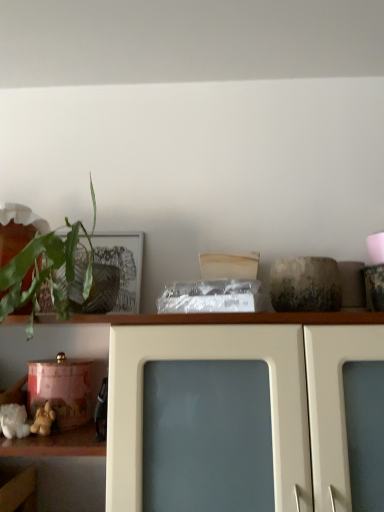
Question: From the image's perspective, is green leafy plant at left below white glossy cabinet at upper center?

Choices:
 (A) no
 (B) yes

Answer: (A)

Question: Does green leafy plant at left have a greater height compared to white glossy cabinet at upper center?

Choices:
 (A) no
 (B) yes

Answer: (A)

Question: From the image's perspective, is green leafy plant at left on top of white glossy cabinet at upper center?

Choices:
 (A) no
 (B) yes

Answer: (B)

Question: Does green leafy plant at left have a lesser width compared to white glossy cabinet at upper center?

Choices:
 (A) no
 (B) yes

Answer: (B)

Question: Is green leafy plant at left not within white glossy cabinet at upper center?

Choices:
 (A) yes
 (B) no

Answer: (A)

Question: Is white glossy cabinet at upper center located within green leafy plant at left?

Choices:
 (A) yes
 (B) no

Answer: (B)

Question: Does white glossy cabinet at upper center have a lesser width compared to green leafy plant at left?

Choices:
 (A) no
 (B) yes

Answer: (A)

Question: Is white glossy cabinet at upper center positioned with its back to green leafy plant at left?

Choices:
 (A) no
 (B) yes

Answer: (A)

Question: From a real-world perspective, is white glossy cabinet at upper center positioned under green leafy plant at left based on gravity?

Choices:
 (A) no
 (B) yes

Answer: (B)

Question: Can you confirm if white glossy cabinet at upper center is positioned to the left of green leafy plant at left?

Choices:
 (A) yes
 (B) no

Answer: (B)

Question: Is white glossy cabinet at upper center outside of green leafy plant at left?

Choices:
 (A) no
 (B) yes

Answer: (B)

Question: From a real-world perspective, is white glossy cabinet at upper center over green leafy plant at left?

Choices:
 (A) no
 (B) yes

Answer: (A)

Question: Considering the relative sizes of soft yellow plush toy at lower left and green leafy plant at left in the image provided, is soft yellow plush toy at lower left taller than green leafy plant at left?

Choices:
 (A) yes
 (B) no

Answer: (B)